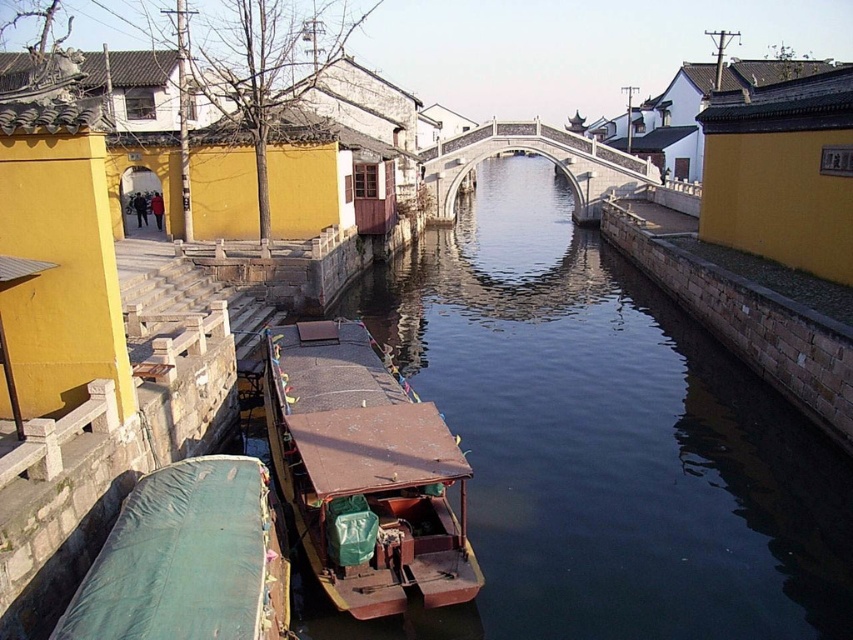
You are a tourist standing on the white stone bridge at center, and you want to take a photo of the rusty brown wooden boat at lower center. Which way should you turn your camera to capture the boat in the frame?

Since the rusty brown wooden boat at lower center is thinner than the white stone bridge at center, you should point your camera downward to capture the boat, which is positioned lower in the scene compared to the bridge.

You are a tourist standing on the stone bridge and want to take a photo of both the rusty brown wooden boat at lower center and the green tarpaulin boat at lower left. Which boat will appear wider in your photo?

The green tarpaulin boat at lower left will appear wider in the photo since its width is greater than the rusty brown wooden boat at lower center.

You are a tourist standing on the stone bridge in the canal scene. You see the smooth dark water at center and the green tarpaulin boat at lower left. Which object is located higher in the scene?

The smooth dark water at center is positioned over the green tarpaulin boat at lower left, so the smooth dark water at center is higher in the scene.